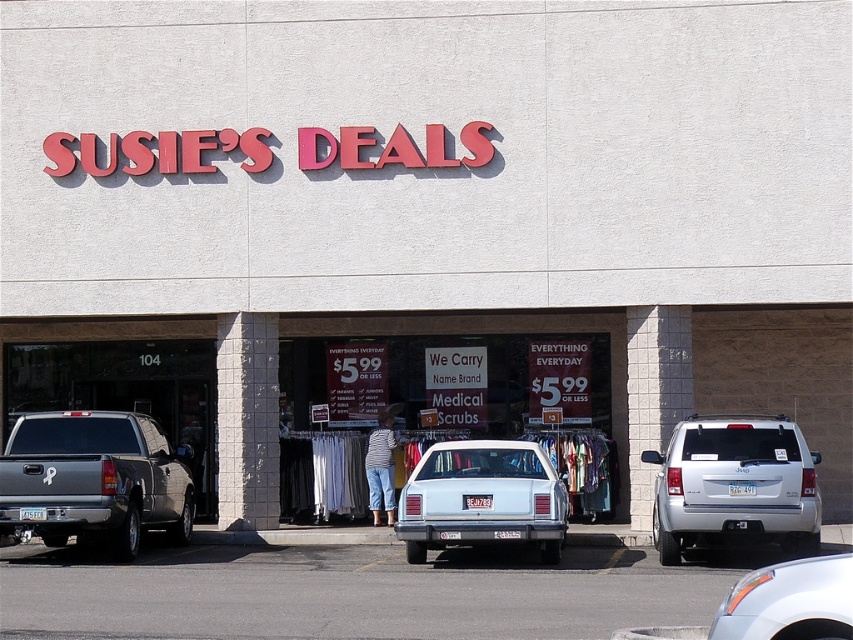
Consider the image. Can you confirm if gray asphalt parking lot at lower center is smaller than white cotton clothing at center?

Incorrect, gray asphalt parking lot at lower center is not smaller in size than white cotton clothing at center.

How much distance is there between gray asphalt parking lot at lower center and white cotton clothing at center?

6.70 meters

The width and height of the screenshot is (853, 640). I want to click on gray asphalt parking lot at lower center, so click(x=355, y=592).

The height and width of the screenshot is (640, 853). Find the location of `gray asphalt parking lot at lower center`. gray asphalt parking lot at lower center is located at coordinates (355, 592).

Where is `silver metallic suv at right`? This screenshot has height=640, width=853. silver metallic suv at right is located at coordinates 735,484.

Between point (682, 497) and point (426, 468), which one is positioned behind?

Positioned behind is point (426, 468).

Who is more forward, [659,472] or [463,492]?

Point [463,492] is in front.

Where is `silver metallic suv at right`? This screenshot has width=853, height=640. silver metallic suv at right is located at coordinates (735, 484).

Does white glossy sedan at center have a greater width compared to satin silver sedan at center?

Yes, white glossy sedan at center is wider than satin silver sedan at center.

Does point (416, 540) come closer to viewer compared to point (819, 630)?

No, (416, 540) is further to viewer.

Where is `white glossy sedan at center`? The height and width of the screenshot is (640, 853). white glossy sedan at center is located at coordinates (482, 499).